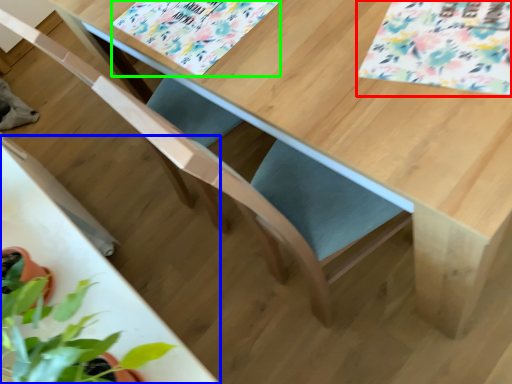
Question: Estimate the real-world distances between objects in this image. Which object is closer to flower (highlighted by a red box), round table (highlighted by a blue box) or flower (highlighted by a green box)?

Choices:
 (A) round table
 (B) flower

Answer: (B)